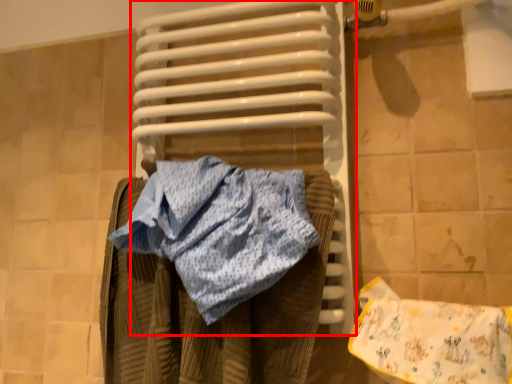
Question: From the image, what is the correct spatial relationship of water heater (annotated by the red box) in relation to material?

Choices:
 (A) left
 (B) right

Answer: (A)